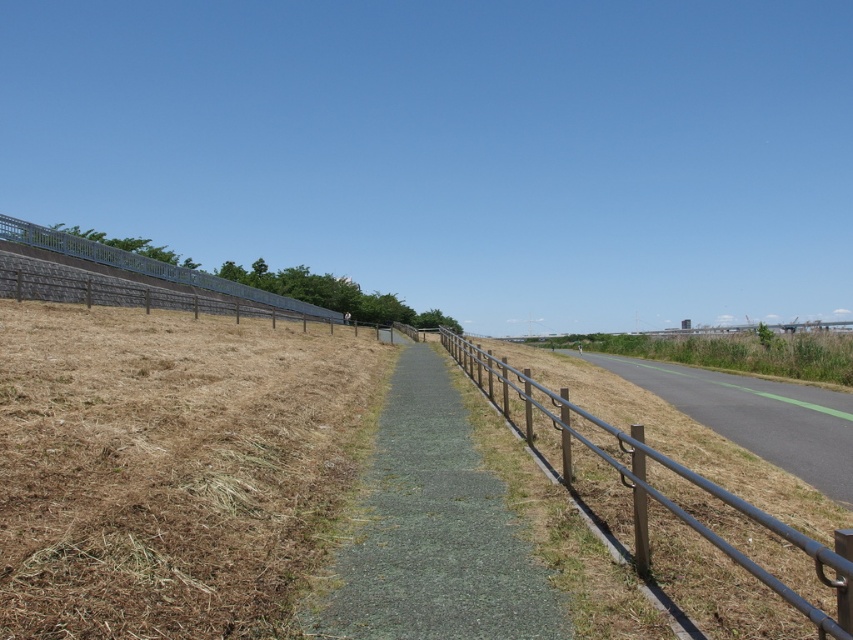
You are standing at the starting point of the paved pathway in the image. You see two points marked on the path. One is at point (836, 484) and the other is at point (82, 257). If you walk straight along the path, which point will you reach first?

Since point (836, 484) is in front of point (82, 257), you will reach point (836, 484) first when walking straight along the path.

You are a painter standing on the paved pathway in the center. You need to paint both the metallic gray fence at center and the metallic gray fence at upper left. Which fence should you paint first if you want to start with the one closer to your current position?

The metallic gray fence at center is closer to your current position on the paved pathway, so you should paint it first.